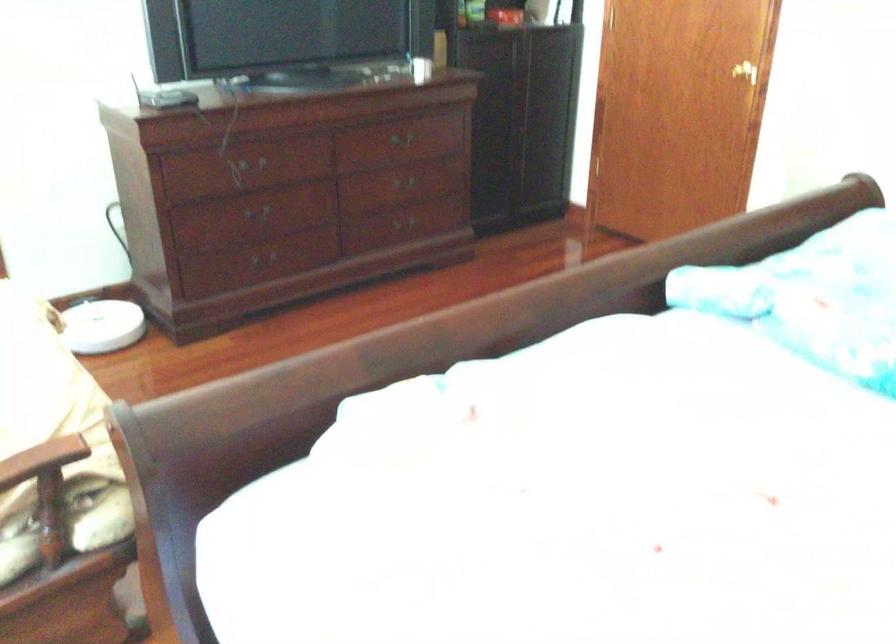
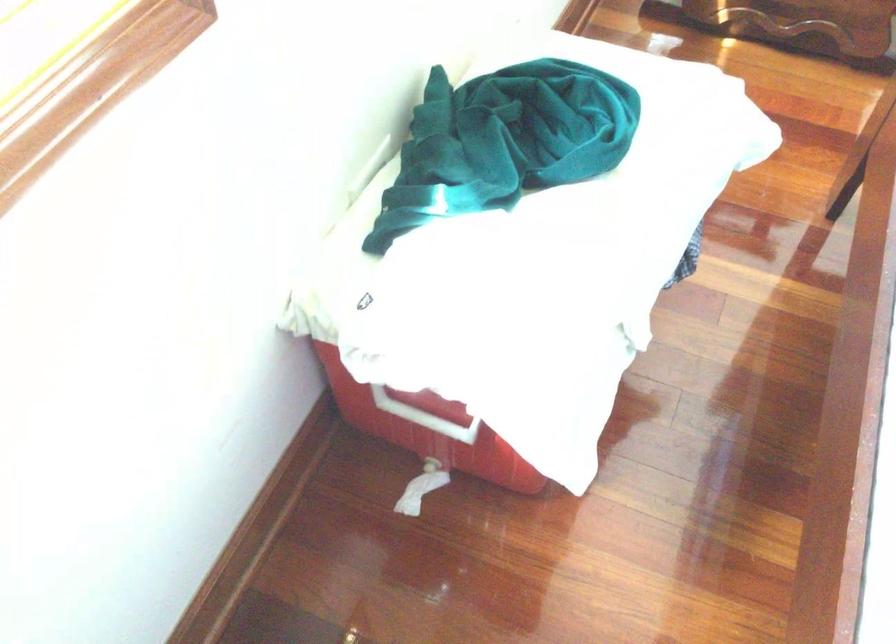
The images are taken continuously from a first-person perspective. In which direction is your viewpoint rotating?

The rotation direction of the camera is left-down.